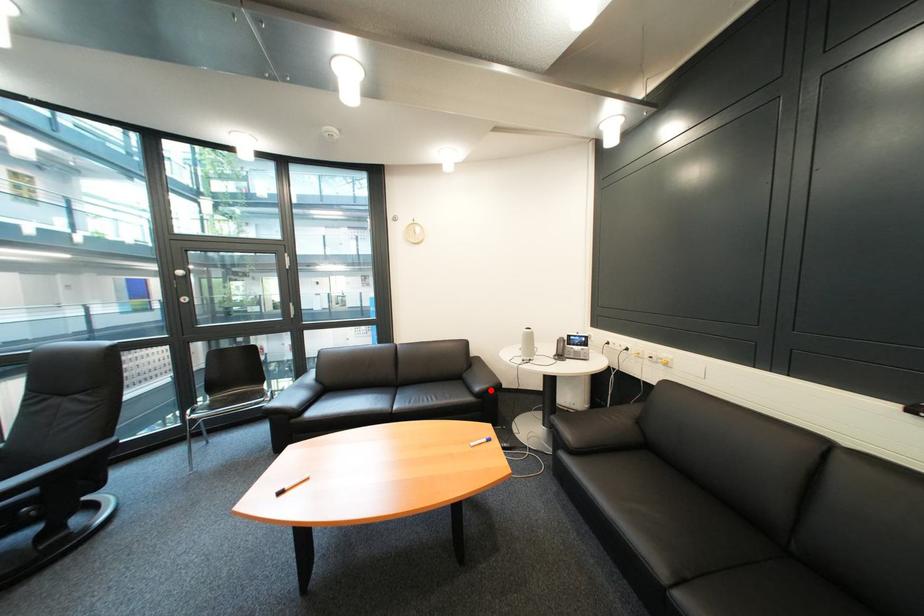
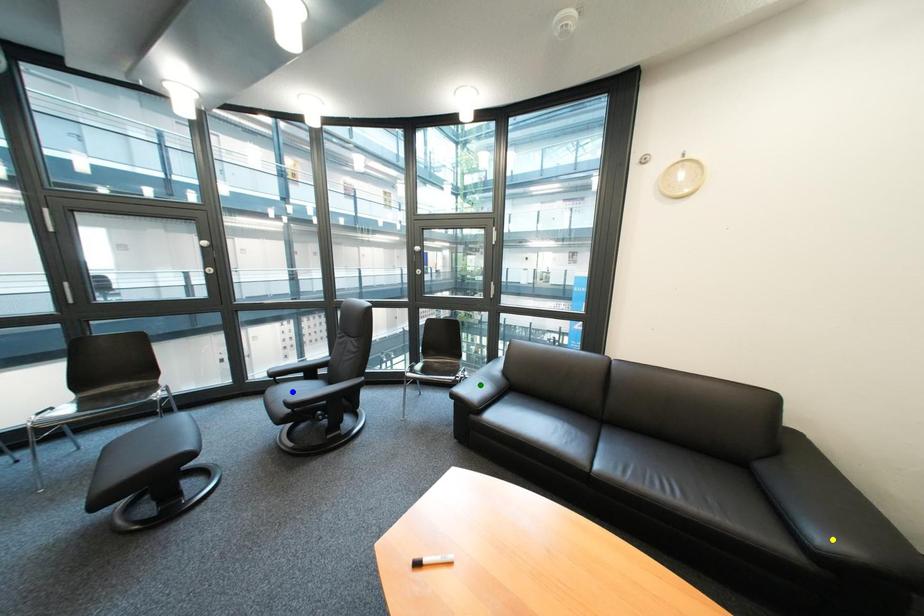
Question: I am providing you with two images of the same scene from different viewpoints. A red point is marked on the first image. You are given multiple points on the second image. Which spot in image 2 lines up with the point in image 1?

Choices:
 (A) yellow point
 (B) green point
 (C) blue point

Answer: (A)